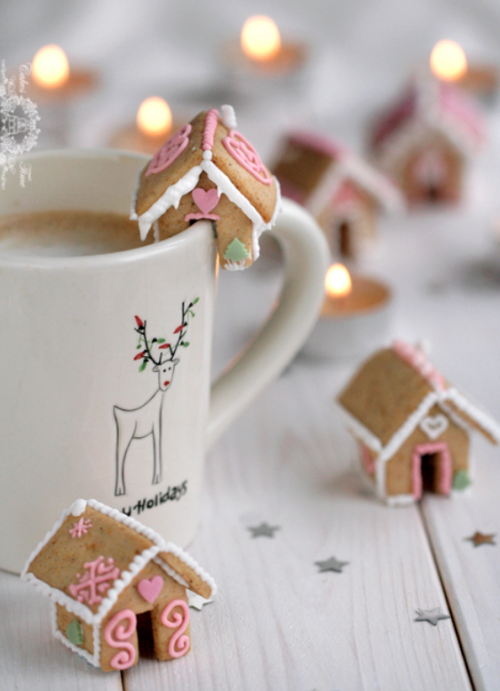
The width and height of the screenshot is (500, 691). Identify the location of 2 pink decorative hearts. (203, 202), (154, 591).